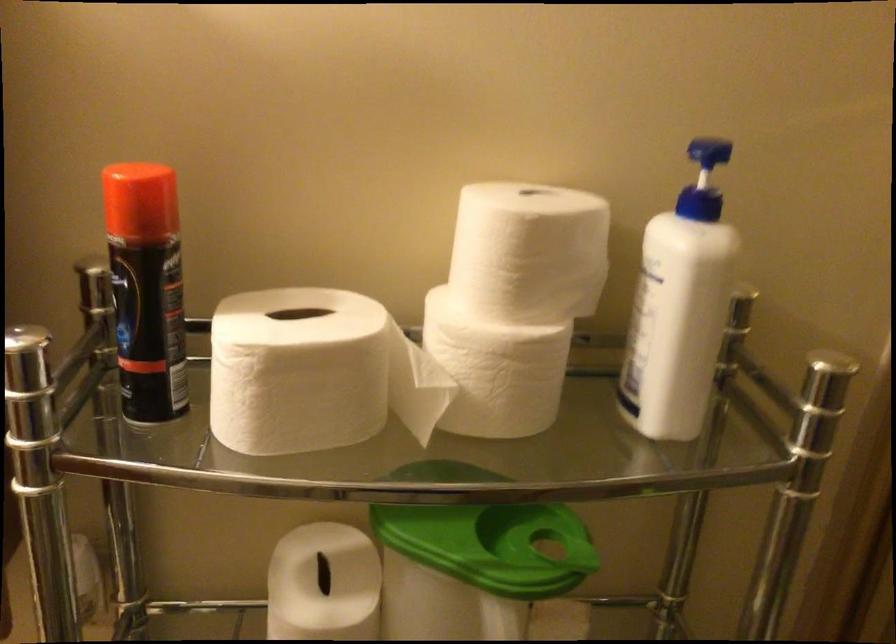
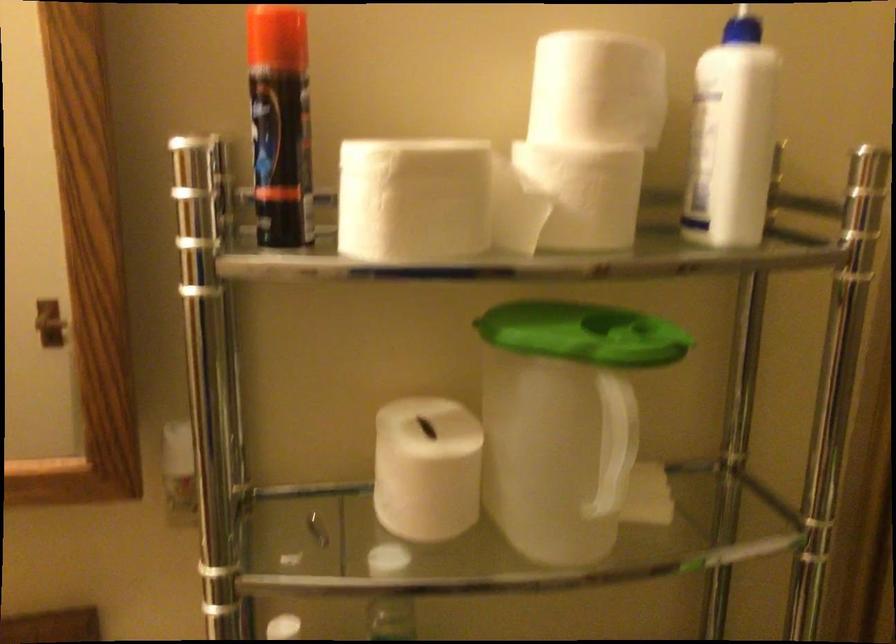
In the second image, find the point that corresponds to (x=450, y=527) in the first image.

(563, 327)